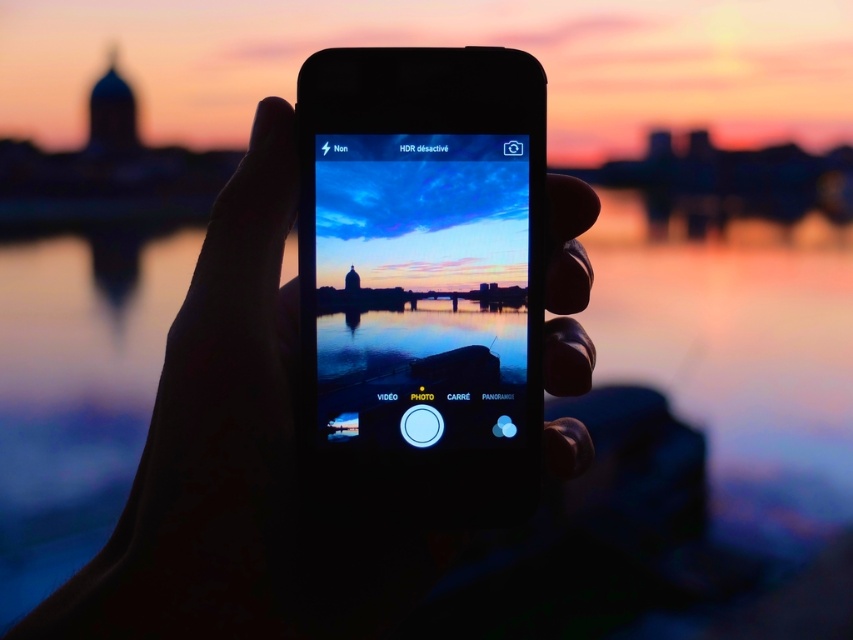
Based on the photo, who is positioned more to the right, matte black smartphone at center or black matte hand at center?

matte black smartphone at center is more to the right.

I want to click on matte black smartphone at center, so click(x=422, y=273).